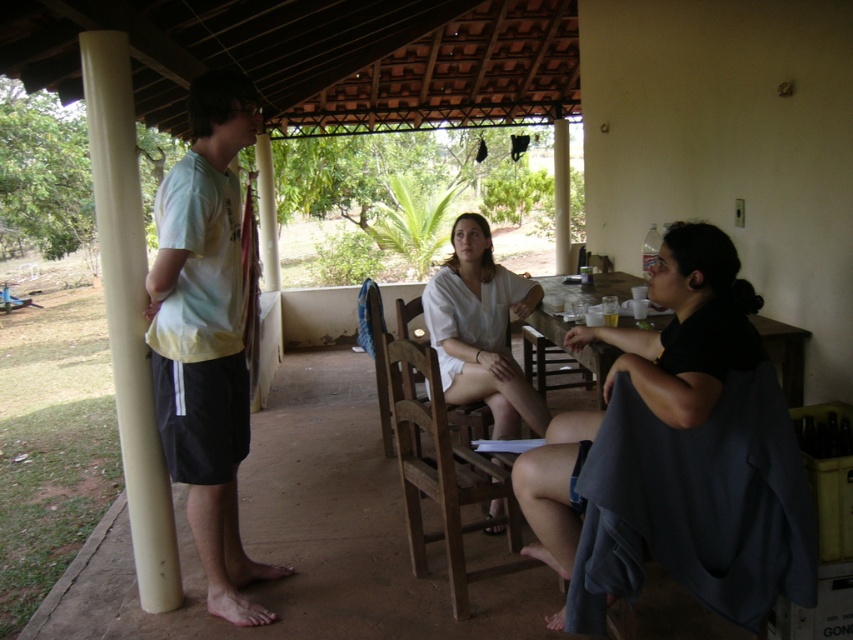
Question: Which point is farther from the camera taking this photo?

Choices:
 (A) (158, 221)
 (B) (453, 323)

Answer: (B)

Question: Is dark gray fabric at lower right bigger than white cotton shirt at center?

Choices:
 (A) yes
 (B) no

Answer: (B)

Question: Among these points, which one is nearest to the camera?

Choices:
 (A) (225, 340)
 (B) (727, 346)
 (C) (416, 564)
 (D) (486, 227)

Answer: (B)

Question: Does dark gray fabric at lower right have a greater width compared to wooden table at center?

Choices:
 (A) yes
 (B) no

Answer: (B)

Question: Considering the real-world distances, which object is farthest from the dark gray fabric at right?

Choices:
 (A) white cotton shirt at center
 (B) wooden table at center

Answer: (B)

Question: Does dark gray fabric at lower right have a greater width compared to light yellow t-shirt at left?

Choices:
 (A) yes
 (B) no

Answer: (A)